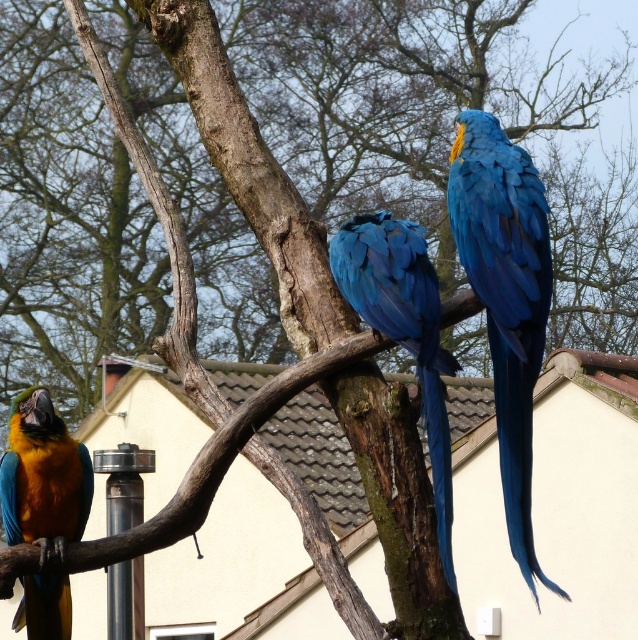
Question: Does blue glossy parrot at upper right come behind blue glossy parrot at center?

Choices:
 (A) yes
 (B) no

Answer: (B)

Question: Can you confirm if blue glossy parrot at center is positioned above matte blue parrot at left?

Choices:
 (A) yes
 (B) no

Answer: (A)

Question: Which object appears farthest from the camera in this image?

Choices:
 (A) matte blue parrot at left
 (B) blue glossy parrot at upper right
 (C) blue glossy parrot at center

Answer: (A)

Question: Is blue glossy parrot at upper right wider than matte blue parrot at left?

Choices:
 (A) no
 (B) yes

Answer: (B)

Question: Based on their relative distances, which object is farther from the blue glossy parrot at upper right?

Choices:
 (A) blue glossy parrot at center
 (B) matte blue parrot at left

Answer: (B)

Question: Among these points, which one is farthest from the camera?

Choices:
 (A) [20, 428]
 (B) [545, 278]

Answer: (A)